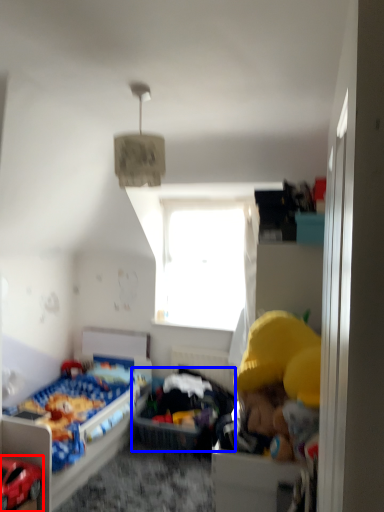
Question: Which of the following is the closest to the observer, toy (highlighted by a red box) or infant bed (highlighted by a blue box)?

Choices:
 (A) toy
 (B) infant bed

Answer: (A)